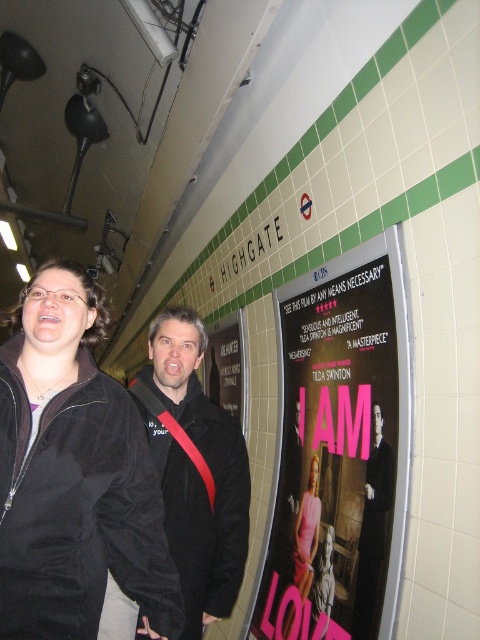
Based on the photo, you are a photographer positioned at the entrance of the subway station. You want to capture a photo of the velvet black jacket at center and the pink satin dress at center. The minimum focus distance for your camera is 35 inches. Will both subjects be in focus?

The distance between the velvet black jacket at center and the pink satin dress at center is 34.98 inches, which is just below the camera minimum focus distance of 35 inches. Therefore, the velvet black jacket at center and the pink satin dress at center will not both be in focus.

You are at the Highgate station and want to find the pink paper poster at center. Where should you look?

The pink paper poster at center is located at point (334, 461).

You are an interior designer assessing the subway station. You need to determine if the pink paper poster at center can fit into a display frame designed for items narrower than the black matte jacket at center. Based on the scene, will the poster fit?

The pink paper poster at center has a lesser width compared to the black matte jacket at center, so it will fit into the display frame designed for items narrower than the jacket.